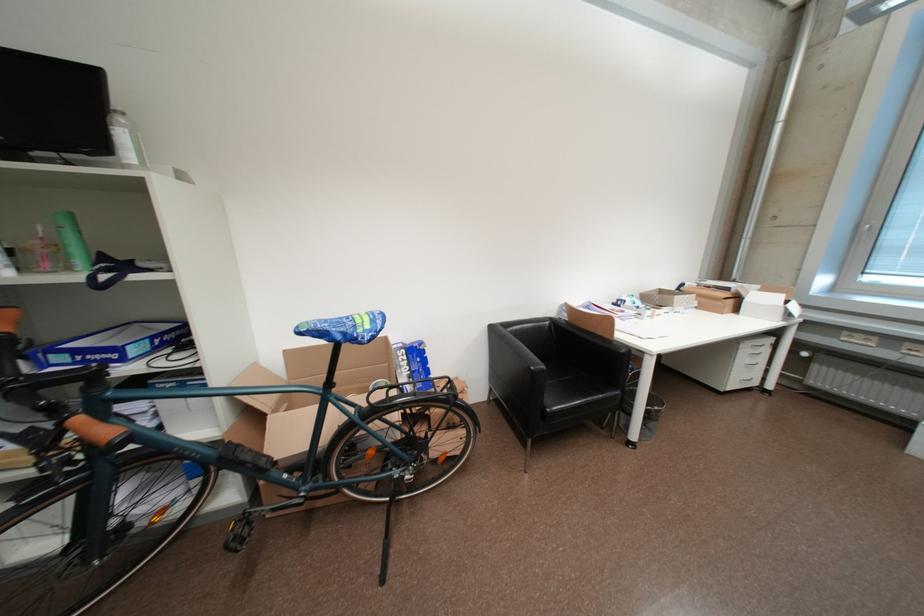
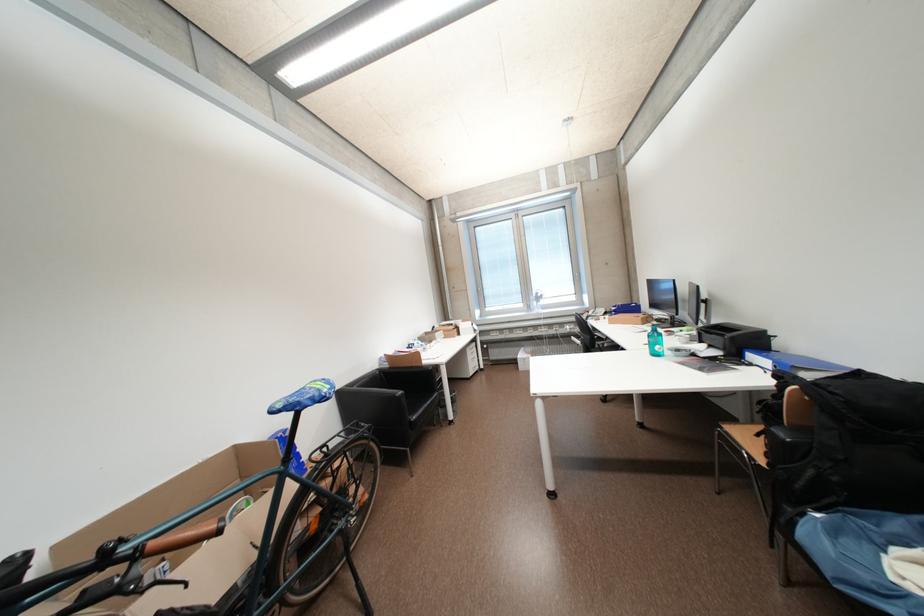
Locate, in the second image, the point that corresponds to (552,369) in the first image.

(408, 394)